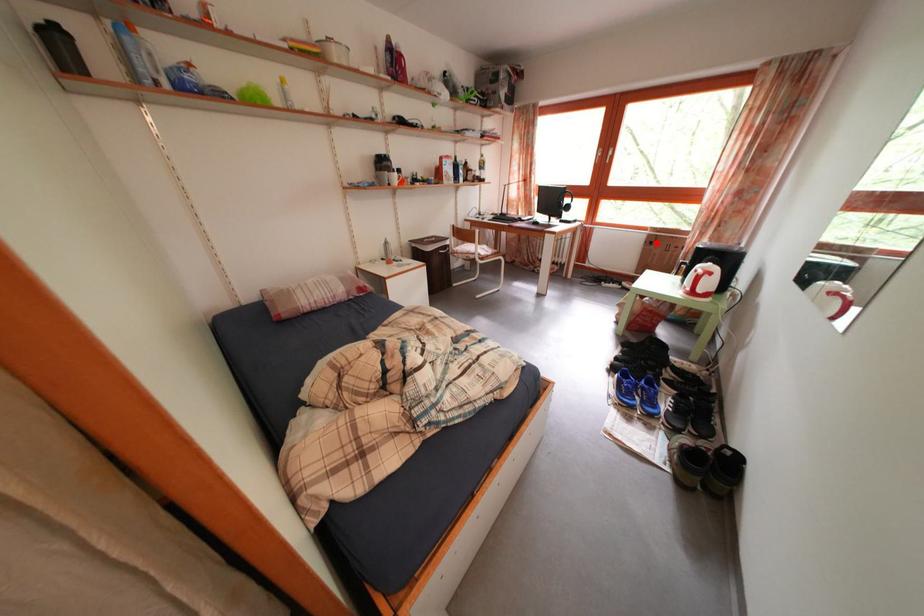
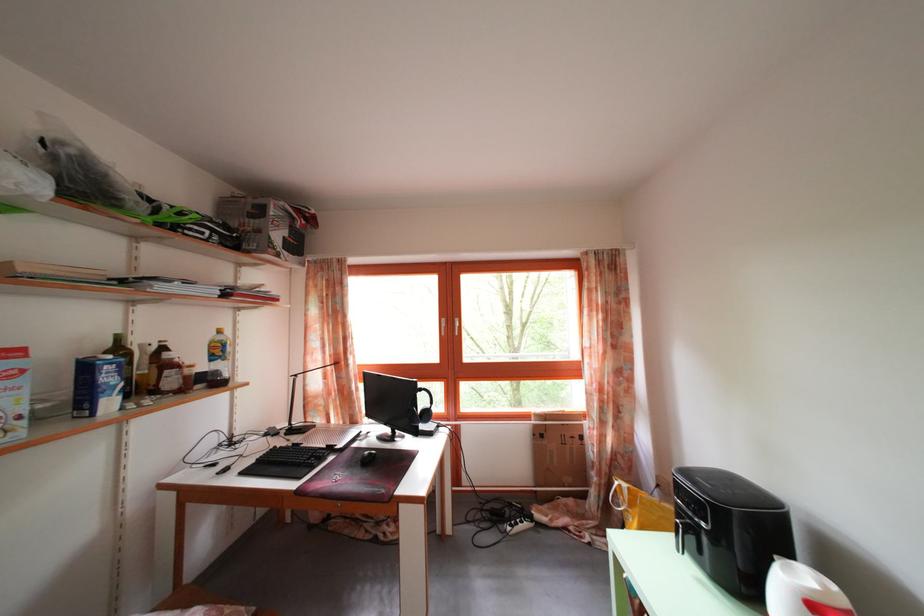
Where in the second image is the point corresponding to the highlighted location from the first image?

(542, 432)